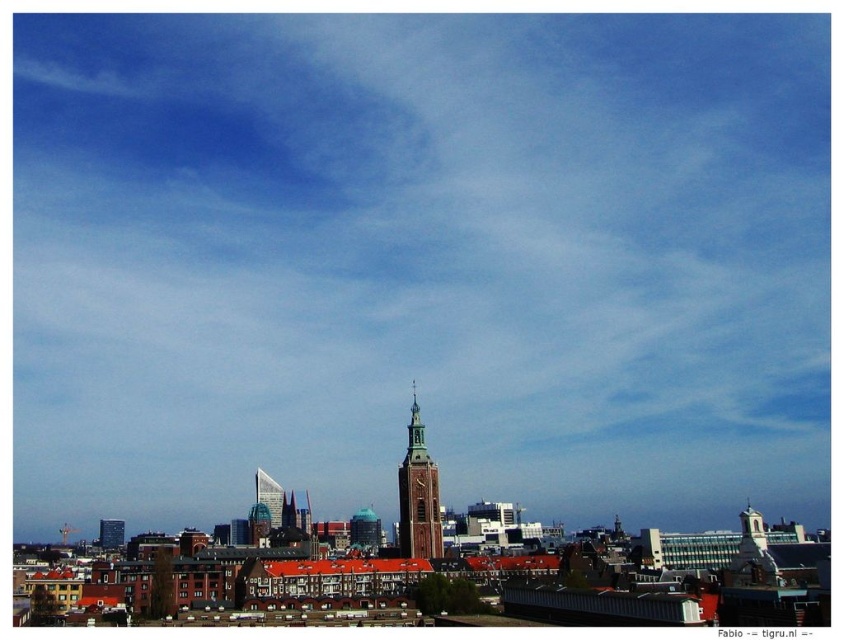
What are the coordinates of the brown brick bell tower at center in the image?

The brown brick bell tower at center is located at coordinates point (418, 493).

You are standing in the cityscape scene and want to reach a specific point marked at coordinates point (x=415, y=486). Given that you can walk 300 feet per minute, how many minutes will it take you to reach that point?

The distance of point (x=415, y=486) from camera is 723.67 feet. At a walking speed of 300 feet per minute, it would take approximately 2.41 minutes to reach the point.